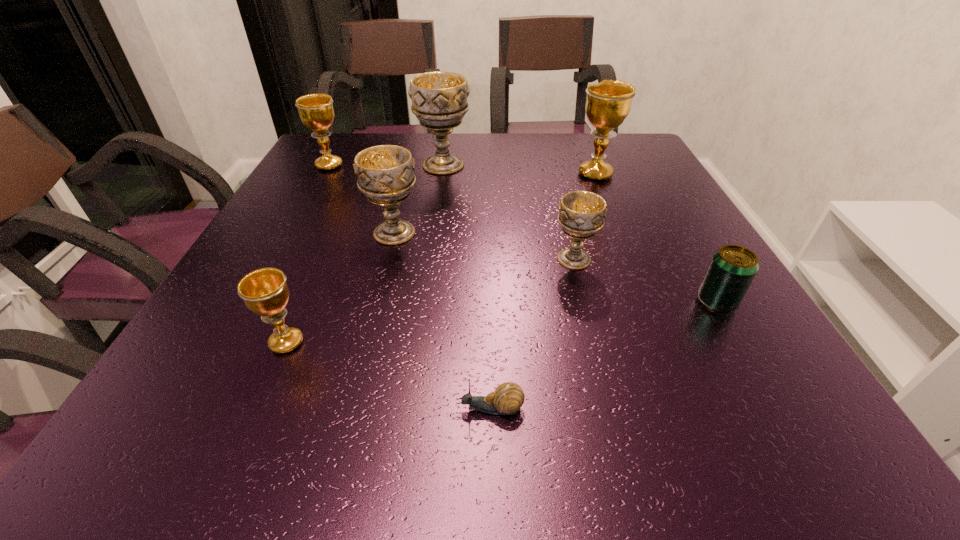
Find the location of `the biggest white chalice`. the biggest white chalice is located at coordinates (x=439, y=99).

The height and width of the screenshot is (540, 960). What are the coordinates of `the biggest gold chalice` in the screenshot? It's located at (608, 103).

Where is `the rightmost gold chalice`? The width and height of the screenshot is (960, 540). the rightmost gold chalice is located at coordinates 608,103.

At what (x,y) coordinates should I click in order to perform the action: click on the leftmost chalice. Please return your answer as a coordinate pair (x, y). Looking at the image, I should click on (316, 111).

Image resolution: width=960 pixels, height=540 pixels. Identify the location of the leftmost gold chalice. (316, 111).

Locate an element on the screen. the second smallest white chalice is located at coordinates (385, 174).

Locate an element on the screen. This screenshot has height=540, width=960. the second chalice from right to left is located at coordinates (582, 213).

Identify the location of the rightmost white chalice. The height and width of the screenshot is (540, 960). (582, 213).

Where is `the second nearest object`? the second nearest object is located at coordinates (265, 292).

Where is `the smallest gold chalice`? Image resolution: width=960 pixels, height=540 pixels. the smallest gold chalice is located at coordinates (265, 292).